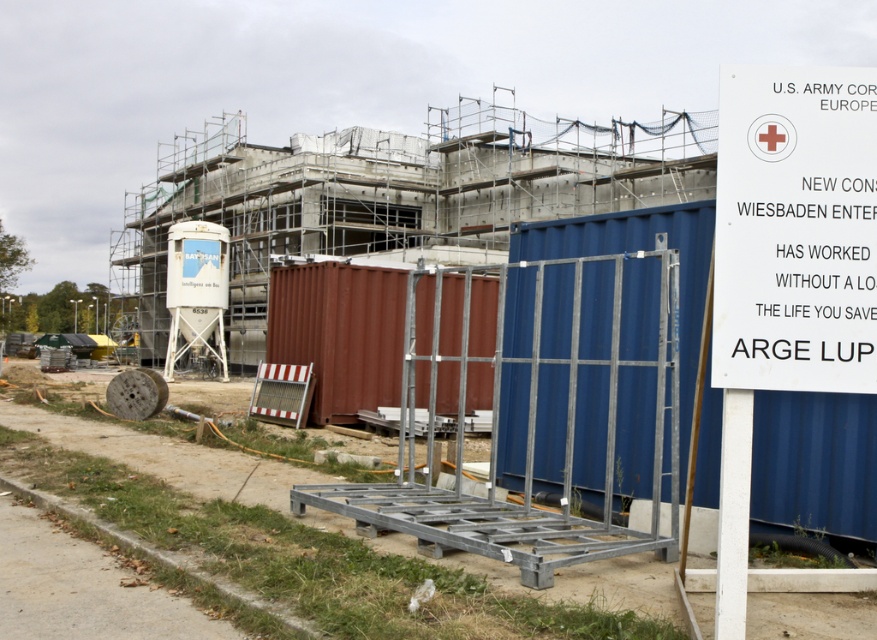
You are a delivery truck driver who needs to park your truck between the blue metallic shipping container at right and the rusty metal shipping container at center. Your truck is 25 feet long. Can you fit your truck between them?

The distance between the blue metallic shipping container at right and the rusty metal shipping container at center is 27.90 feet. Since your truck is 25 feet long, there is enough space to park it between them.

You are a delivery driver arriving at the construction site. You need to park your truck between the blue metallic shipping container at right and the rusty metal shipping container at center. Is there enough space between them to park your truck?

The blue metallic shipping container at right occupies less space than the rusty metal shipping container at center, so there is sufficient space between them to park your truck.

You are a delivery driver who needs to park your truck, which is 3 meters tall, near the construction site. Given the blue metallic shipping container at right and the white paper sign at upper right, which object will block the truck from passing under it due to height restrictions?

The blue metallic shipping container at right has a greater height compared to the white paper sign at upper right. Since the truck is 3 meters tall, the blue metallic shipping container at right would block the truck from passing under it due to its greater height.